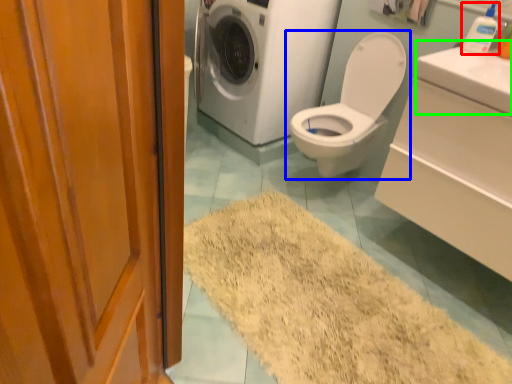
Question: Considering the real-world distances, which object is farthest from toiletry (highlighted by a red box)? toilet (highlighted by a blue box) or counter top (highlighted by a green box)?

Choices:
 (A) toilet
 (B) counter top

Answer: (A)